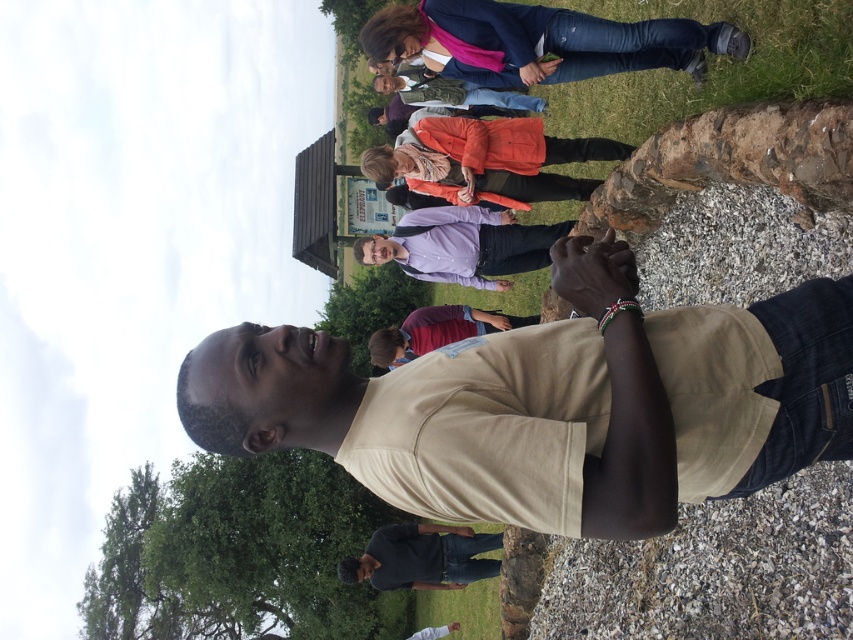
Between green leafy tree at lower left and dark gray cotton shirt at center, which one has more height?

green leafy tree at lower left

Is point (277, 557) farther from viewer compared to point (381, 532)?

Yes, it is.

You are a GUI agent. You are given a task and a screenshot of the screen. Output one action in this format:
    pyautogui.click(x=<x>, y=<y>)
    Task: Click on the green leafy tree at lower left
    The height and width of the screenshot is (640, 853).
    Given the screenshot: What is the action you would take?
    pyautogui.click(x=270, y=547)

I want to click on green leafy tree at lower left, so click(270, 547).

Which is in front, point (444, 61) or point (461, 209)?

Positioned in front is point (444, 61).

Who is shorter, denim jeans at upper right or purple cotton shirt at center?

With less height is purple cotton shirt at center.

Does point (560, 52) lie behind point (462, 276)?

No, (560, 52) is closer to viewer.

This screenshot has width=853, height=640. Identify the location of denim jeans at upper right. coord(540,42).

Which is behind, point (468, 248) or point (369, 349)?

Positioned behind is point (369, 349).

Can you confirm if purple cotton shirt at center is thinner than maroon fabric shirt at center?

In fact, purple cotton shirt at center might be wider than maroon fabric shirt at center.

Describe the element at coordinates (462, 244) in the screenshot. This screenshot has height=640, width=853. I see `purple cotton shirt at center` at that location.

Where is `purple cotton shirt at center`? purple cotton shirt at center is located at coordinates (462, 244).